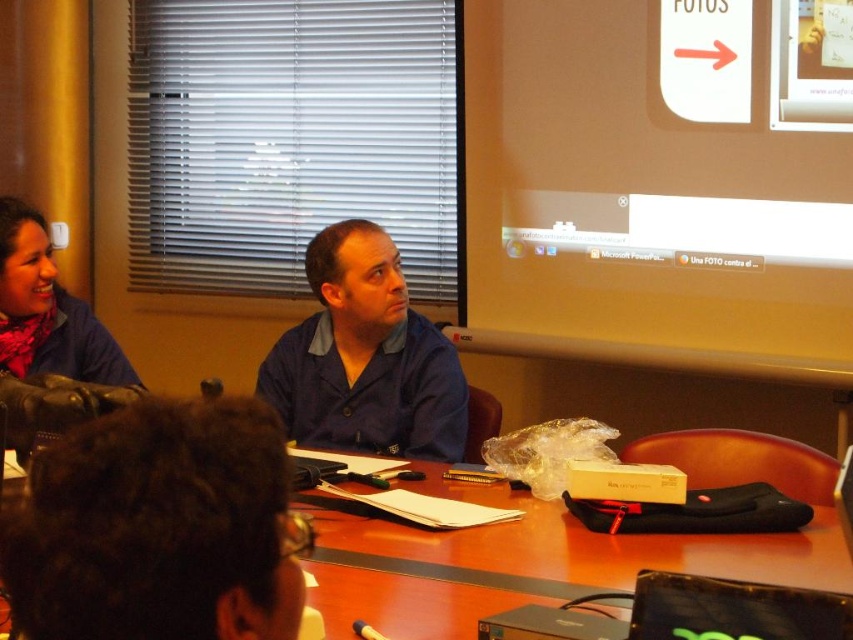
Question: Which object is closer to the camera taking this photo?

Choices:
 (A) blue fabric shirt at center
 (B) matte blue shirt at left
 (C) brown wooden table at center

Answer: (C)

Question: Is white glossy projection screen at upper center thinner than blue fabric shirt at center?

Choices:
 (A) yes
 (B) no

Answer: (B)

Question: Is white glossy projection screen at upper center further to the viewer compared to dark brown hair at lower left?

Choices:
 (A) yes
 (B) no

Answer: (A)

Question: Which object is farther from the camera taking this photo?

Choices:
 (A) blue fabric shirt at center
 (B) white glossy projection screen at upper center
 (C) dark brown hair at lower left
 (D) matte blue shirt at left

Answer: (B)

Question: Can you confirm if white glossy projection screen at upper center is positioned below matte blue shirt at left?

Choices:
 (A) yes
 (B) no

Answer: (B)

Question: Which point appears farthest from the camera in this image?

Choices:
 (A) (769, 260)
 (B) (297, 547)

Answer: (A)